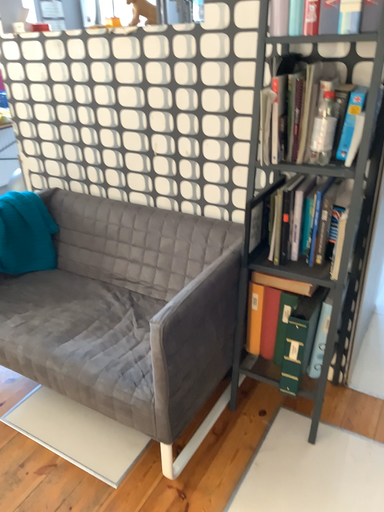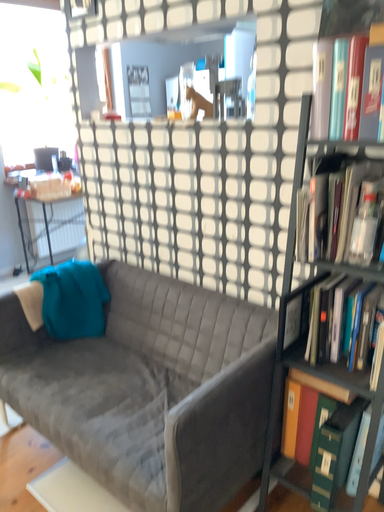
Question: Which way did the camera rotate in the video?

Choices:
 (A) rotated right
 (B) rotated left

Answer: (B)